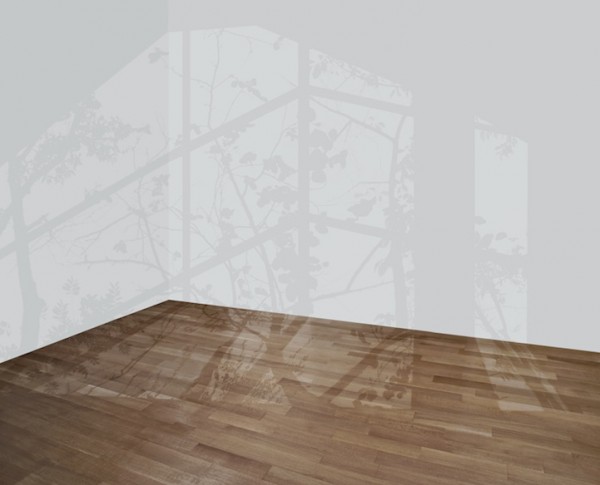
At what (x,y) coordinates should I click in order to perform the action: click on left white wall in background. Please return your answer as a coordinate pair (x, y). This screenshot has height=485, width=600. Looking at the image, I should click on (53, 255).